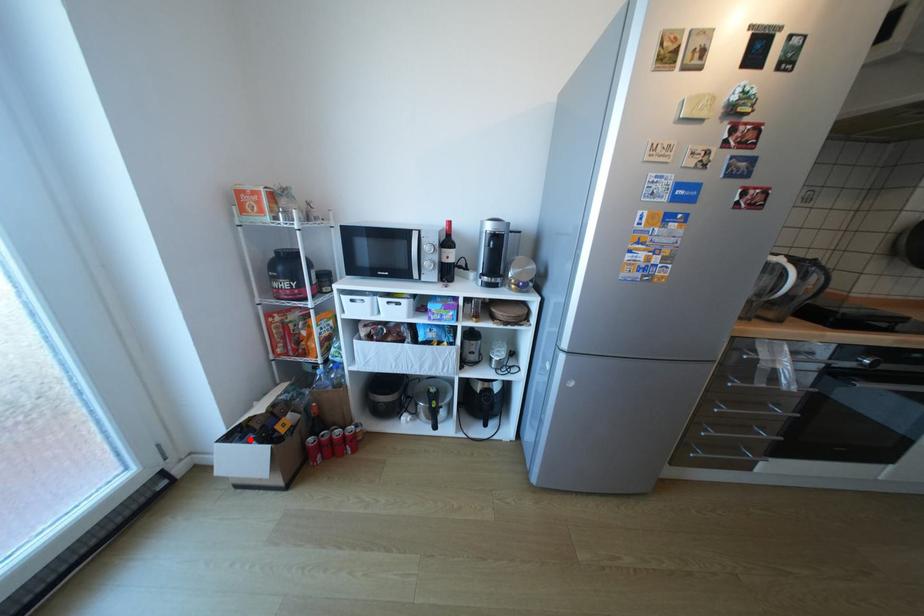
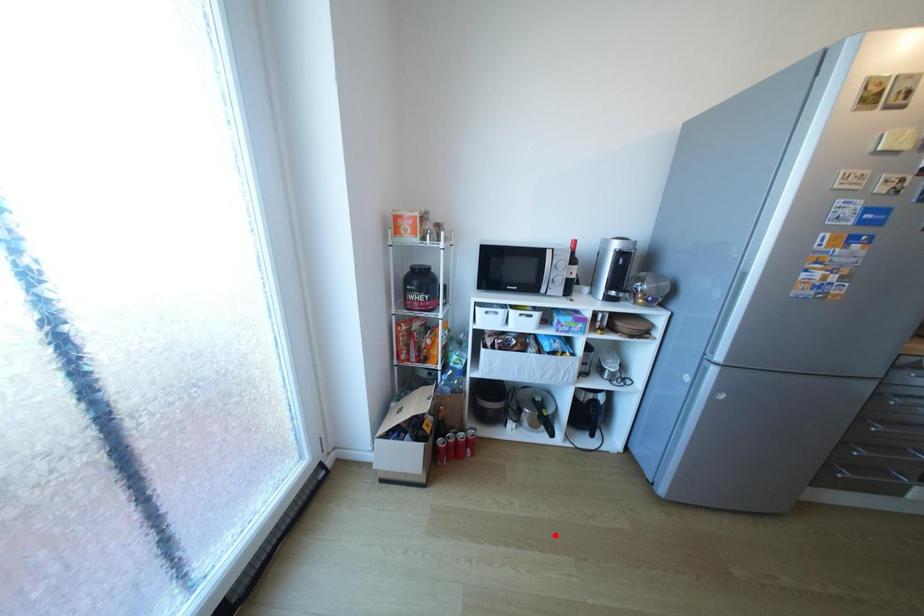
I am providing you with two images of the same scene from different viewpoints. A red point is marked on the first image and another point is marked on the second image. Is the marked point in image1 the same physical position as the marked point in image2?

No